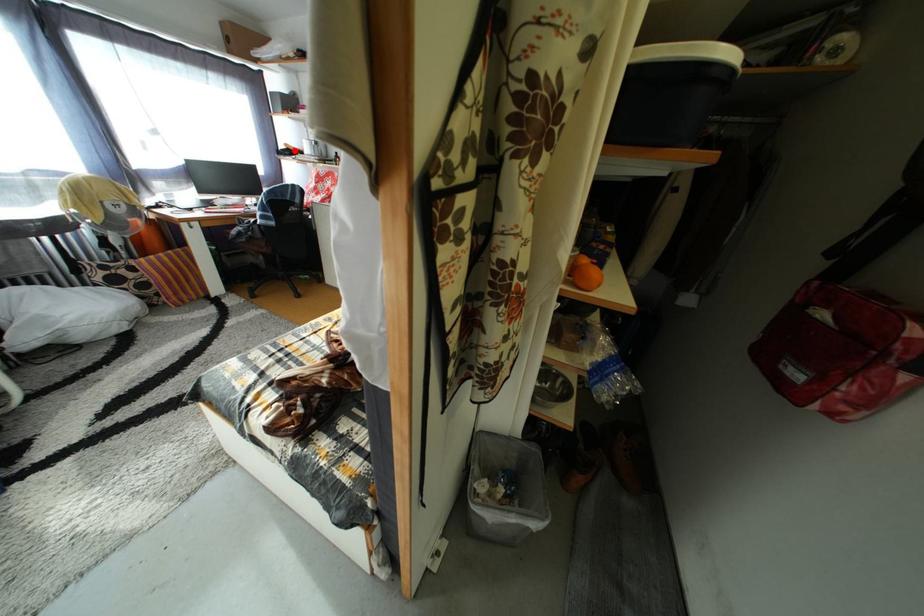
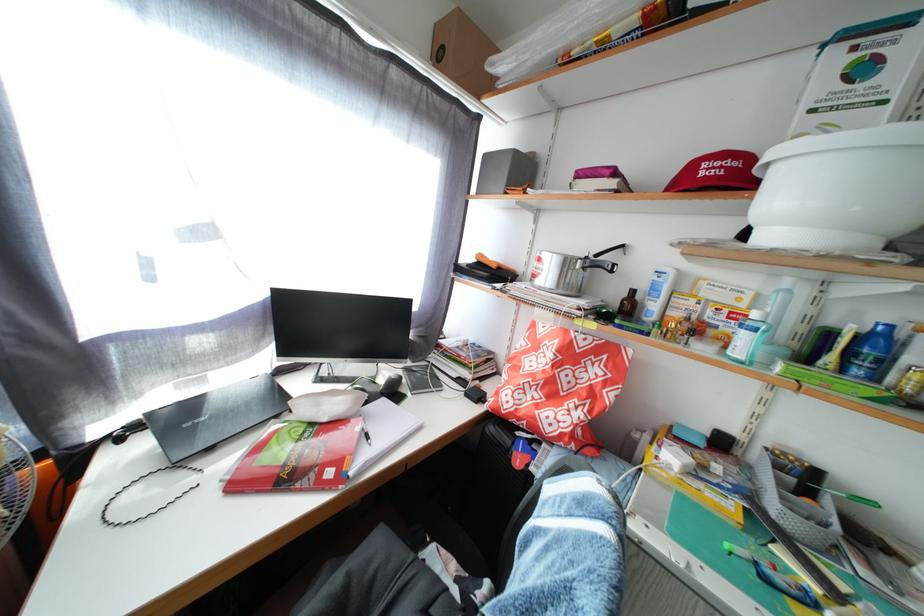
Question: A red point is marked in image1. In image2, is the corresponding 3D point closer to the camera or farther? Reply with the corresponding letter.

Choices:
 (A) The corresponding 3D point is closer.
 (B) The corresponding 3D point is farther.

Answer: (B)